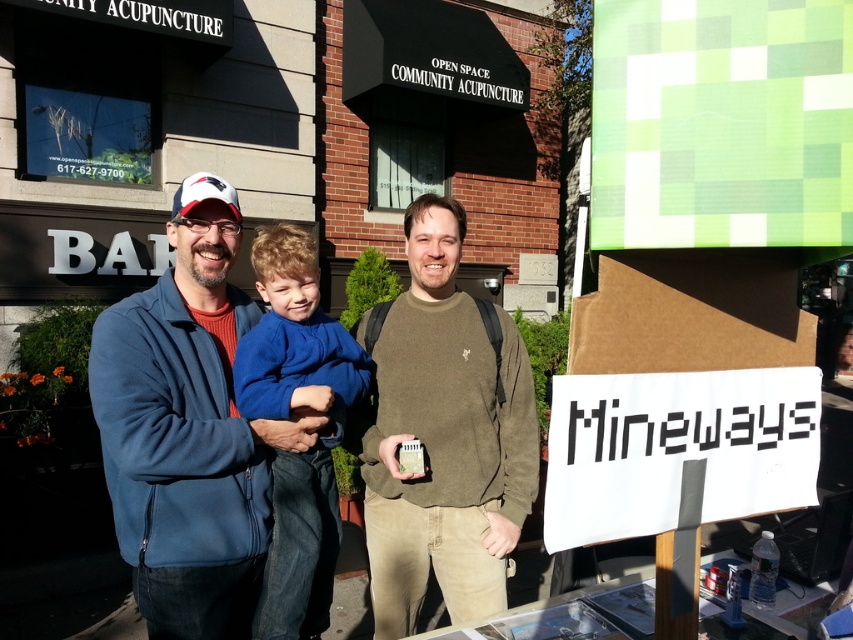
Question: From the image, what is the correct spatial relationship of green matte sweater at center in relation to blue fleece sweater at center?

Choices:
 (A) below
 (B) above

Answer: (B)

Question: Which object is closer to the camera taking this photo?

Choices:
 (A) matte white baseball cap at upper left
 (B) blue fleece sweater at center

Answer: (A)

Question: Is green matte sweater at center to the left of matte white baseball cap at upper left from the viewer's perspective?

Choices:
 (A) yes
 (B) no

Answer: (B)

Question: Among these objects, which one is nearest to the camera?

Choices:
 (A) green matte sweater at center
 (B) blue fleece jacket at left
 (C) blue fleece sweater at center
 (D) matte white baseball cap at upper left

Answer: (B)

Question: Which point is closer to the camera?

Choices:
 (A) (291, 612)
 (B) (527, 397)
 (C) (223, 632)

Answer: (C)

Question: Can you confirm if blue fleece jacket at left is thinner than matte white baseball cap at upper left?

Choices:
 (A) yes
 (B) no

Answer: (B)